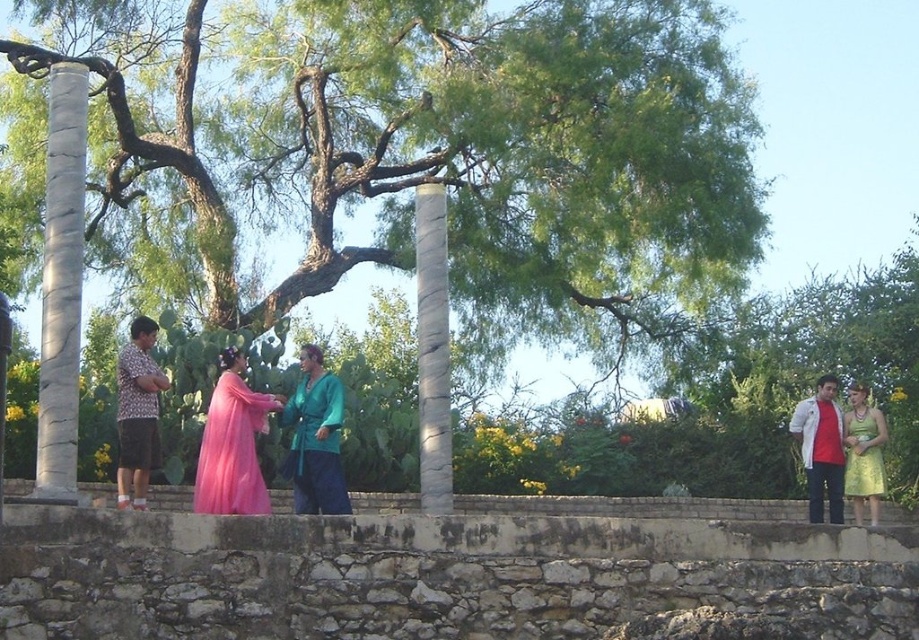
Question: Does marble column at left have a greater width compared to teal satin robe at center?

Choices:
 (A) yes
 (B) no

Answer: (A)

Question: Is green leafy tree at center positioned behind marble column at center?

Choices:
 (A) no
 (B) yes

Answer: (B)

Question: Based on their relative distances, which object is nearer to the green leafy tree at center?

Choices:
 (A) green satin dress at right
 (B) white cotton shirt at right
 (C) marble column at center

Answer: (C)

Question: Does printed cotton shirt at left appear on the left side of white cotton shirt at right?

Choices:
 (A) yes
 (B) no

Answer: (A)

Question: Which point is closer to the camera?

Choices:
 (A) teal satin robe at center
 (B) green leafy tree at center
 (C) green satin dress at right

Answer: (A)

Question: Which is nearer to the teal satin robe at center?

Choices:
 (A) green satin dress at right
 (B) marble column at center
 (C) white cotton shirt at right
 (D) marble column at left

Answer: (B)